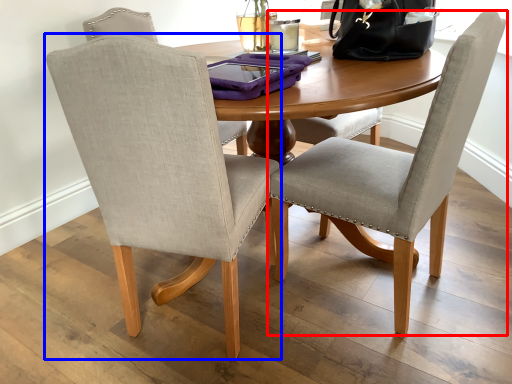
Question: Which object is closer to the camera taking this photo, chair (highlighted by a red box) or chair (highlighted by a blue box)?

Choices:
 (A) chair
 (B) chair

Answer: (B)